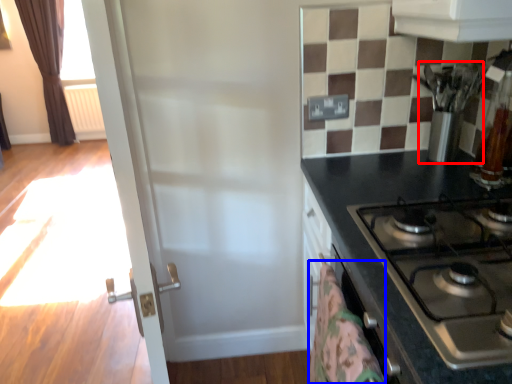
Question: Which object appears farthest to the camera in this image, appliance (highlighted by a red box) or blanket (highlighted by a blue box)?

Choices:
 (A) appliance
 (B) blanket

Answer: (A)